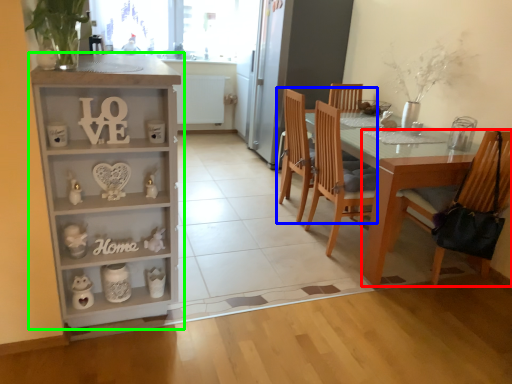
Question: Which is nearer to the chair (highlighted by a red box)? chair (highlighted by a blue box) or cabinetry (highlighted by a green box).

Choices:
 (A) chair
 (B) cabinetry

Answer: (A)